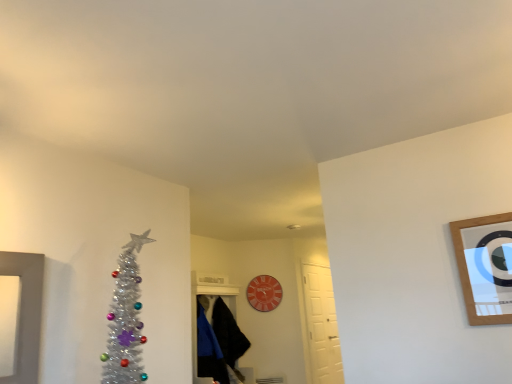
Question: Based on their positions, is wooden-framed mirror at upper right located to the left or right of black fuzzy robe at center, the second robe in the front-to-back sequence?

Choices:
 (A) left
 (B) right

Answer: (B)

Question: Relative to black fuzzy robe at center, the first robe when ordered from back to front, is wooden-framed mirror at upper right in front or behind?

Choices:
 (A) behind
 (B) front

Answer: (B)

Question: Based on their relative distances, which object is farther from the black fuzzy robe at center, the second robe in the front-to-back sequence?

Choices:
 (A) black matte robe at center, which ranks as the 2th robe in back-to-front order
 (B) white matte door at center-right
 (C) wooden-framed mirror at upper right

Answer: (C)

Question: Considering the real-world distances, which object is closest to the black matte robe at center, which ranks as the 2th robe in back-to-front order?

Choices:
 (A) white matte door at center-right
 (B) wooden-framed mirror at upper right
 (C) black fuzzy robe at center, the first robe when ordered from back to front

Answer: (C)